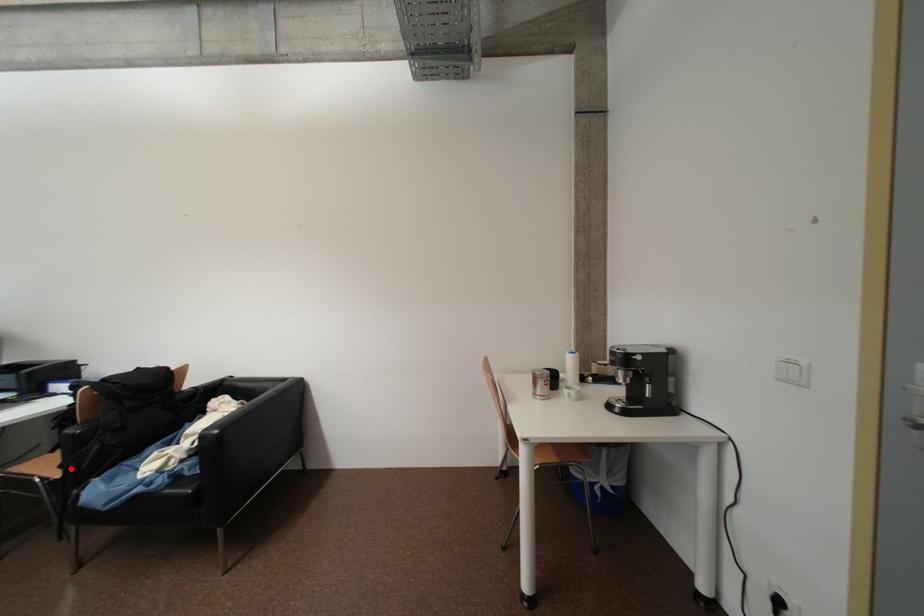
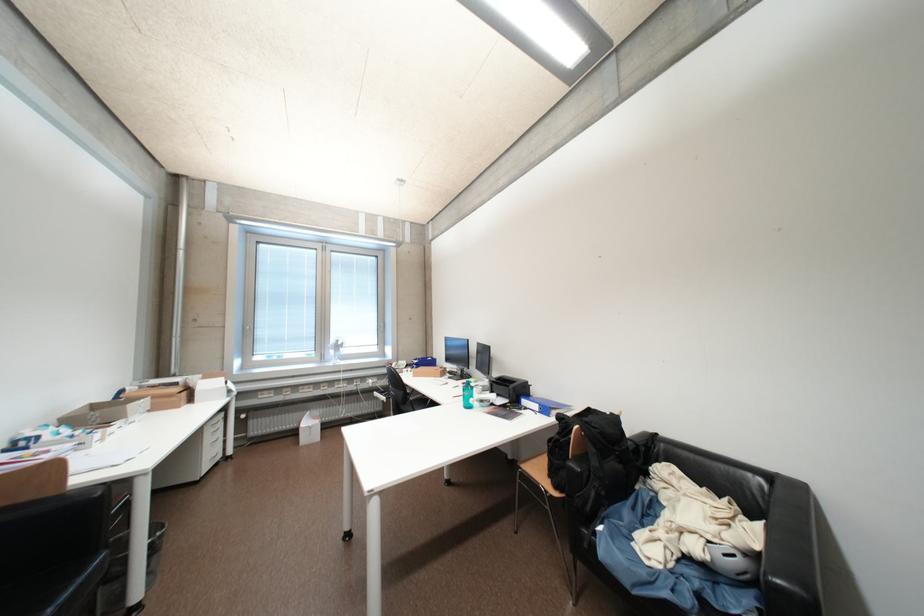
Where in the second image is the point corresponding to the highlighted location from the first image?

(564, 488)